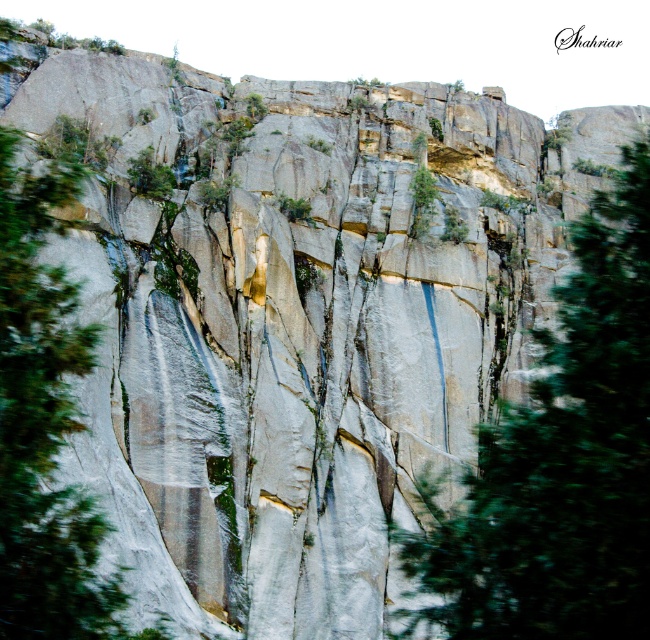
Question: Is green leafy tree at center wider than green leafy tree at left?

Choices:
 (A) yes
 (B) no

Answer: (A)

Question: Is green leafy tree at center to the left of green leafy tree at left from the viewer's perspective?

Choices:
 (A) no
 (B) yes

Answer: (A)

Question: Is green leafy tree at center smaller than green leafy tree at left?

Choices:
 (A) no
 (B) yes

Answer: (A)

Question: Among these objects, which one is farthest from the camera?

Choices:
 (A) green leafy tree at left
 (B) green leafy tree at center

Answer: (A)

Question: Which of the following is the closest to the observer?

Choices:
 (A) (x=34, y=259)
 (B) (x=512, y=497)

Answer: (B)

Question: Which of the following is the closest to the observer?

Choices:
 (A) green leafy tree at left
 (B) green leafy tree at center

Answer: (B)